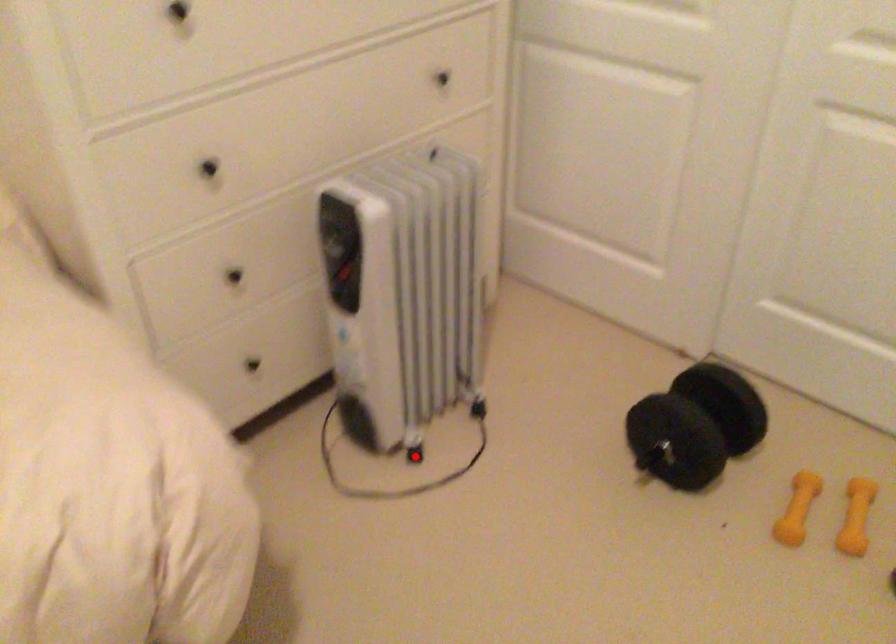
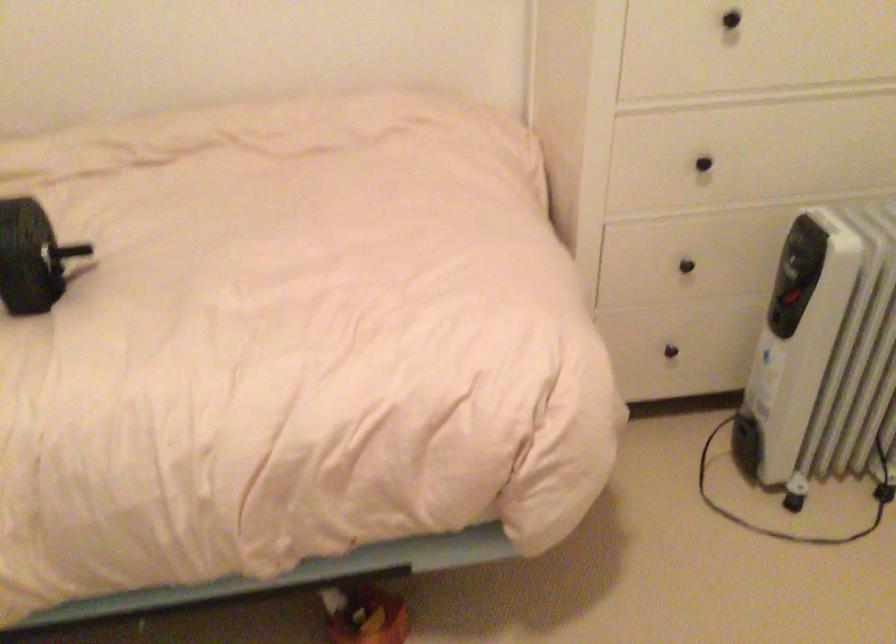
The point at the highlighted location is marked in the first image. Where is the corresponding point in the second image?

(793, 502)